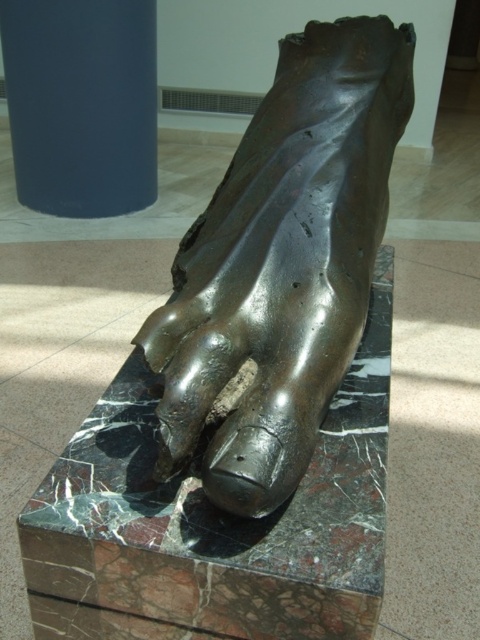
You are an art curator arranging a new exhibition. You notice the shiny bronze foot at center and the blue matte cylinder at upper left in the image. Which object is positioned higher up in the scene?

The blue matte cylinder at upper left is positioned higher up in the scene than the shiny bronze foot at center.

You are an art curator standing in front of the sculpture. You notice a specific point marked at coordinates (283, 260). Which part of the sculpture does this point correspond to?

The point at coordinates (283, 260) is on the shiny bronze foot at center.